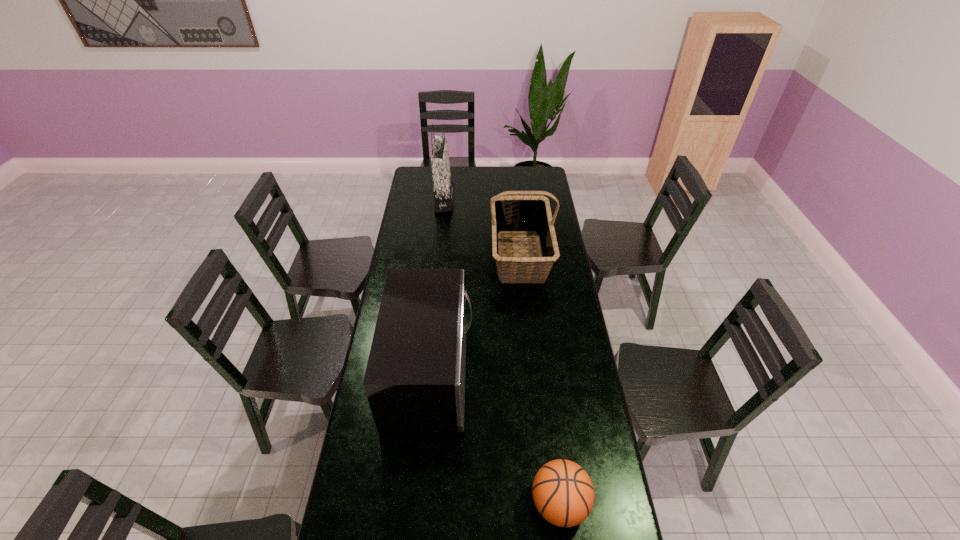
Find the location of `vacant area between the third tallest object and the shortest object`. vacant area between the third tallest object and the shortest object is located at coordinates (495, 438).

Where is `free area in between the second farthest object and the second shortest object`? Image resolution: width=960 pixels, height=540 pixels. free area in between the second farthest object and the second shortest object is located at coordinates (475, 314).

Identify the location of vacant space that is in between the basketball and the third nearest object. (540, 379).

You are a GUI agent. You are given a task and a screenshot of the screen. Output one action in this format:
    pyautogui.click(x=<x>, y=<y>)
    Task: Click on the vacant area that lies between the nearest object and the shopping bag
    This screenshot has width=960, height=540.
    Given the screenshot: What is the action you would take?
    pyautogui.click(x=502, y=352)

Point out which object is positioned as the nearest to the third tallest object. Please provide its 2D coordinates. Your answer should be formatted as a tuple, i.e. [(x, y)], where the tuple contains the x and y coordinates of a point satisfying the conditions above.

[(519, 214)]

Find the location of a particular element. The image size is (960, 540). the second closest object to the second tallest object is located at coordinates (443, 185).

Where is `free location that satisfies the following two spatial constraints: 1. on the front of the nearest object with the design; 2. on the left side of the shopping bag`? free location that satisfies the following two spatial constraints: 1. on the front of the nearest object with the design; 2. on the left side of the shopping bag is located at coordinates [414, 503].

Where is `free location that satisfies the following two spatial constraints: 1. on the front of the shopping bag with the design; 2. on the right side of the nearest object`? The height and width of the screenshot is (540, 960). free location that satisfies the following two spatial constraints: 1. on the front of the shopping bag with the design; 2. on the right side of the nearest object is located at coordinates (414, 503).

The width and height of the screenshot is (960, 540). I want to click on vacant area that satisfies the following two spatial constraints: 1. with the door open on the third tallest object; 2. on the left side of the shortest object, so click(x=419, y=503).

What are the coordinates of `vacant space that satisfies the following two spatial constraints: 1. on the front of the farthest object with the design; 2. on the right side of the basketball` in the screenshot? It's located at (414, 503).